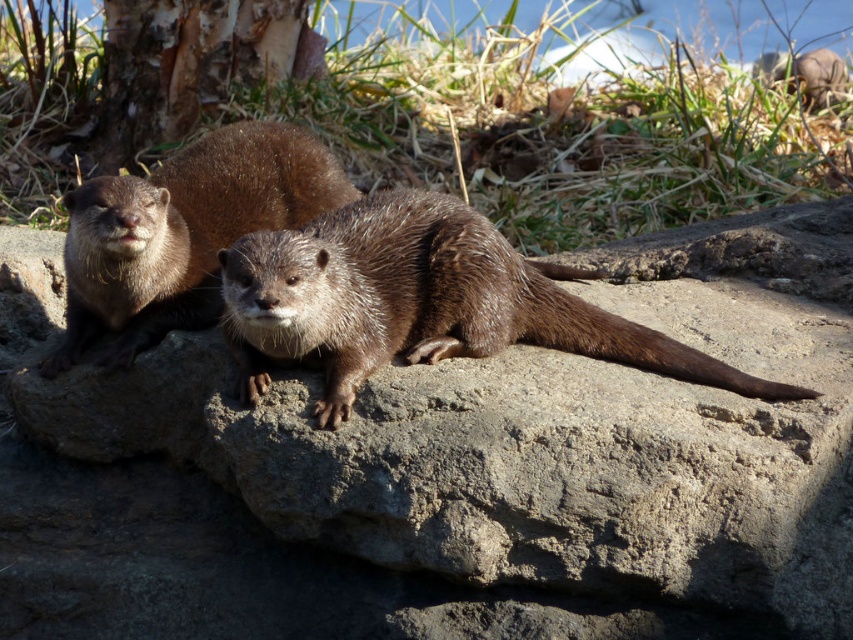
You are an animal researcher observing the scene. You need to determine which object occupies more space in the image between the gray rough rock at center and the brown furry otter at center. Which one is larger?

The gray rough rock at center is bigger than the brown furry otter at center, so the gray rough rock at center occupies more space in the image.